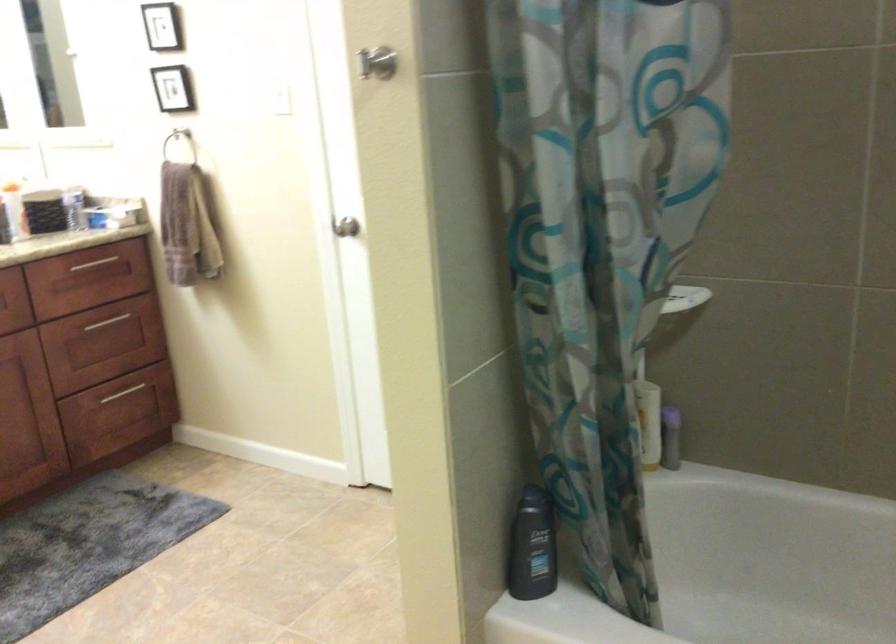
Find where to squeez the dark grey bottle. Please return your answer as a coordinate pair (x, y).

(531, 547)